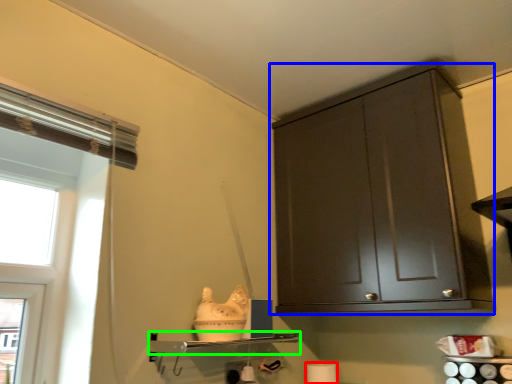
Question: Which object is the closest to the toilet paper (highlighted by a red box)? Choose among these: cabinetry (highlighted by a blue box) or shelf (highlighted by a green box).

Choices:
 (A) cabinetry
 (B) shelf

Answer: (B)